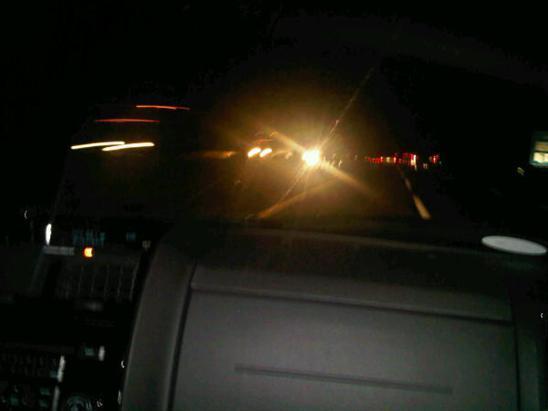
Locate an element on the screen. light is located at coordinates pos(267,151).